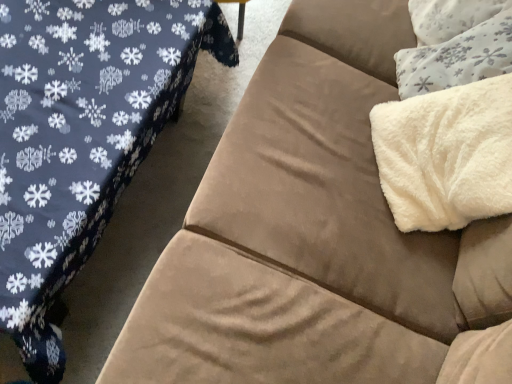
Find the location of a particular element. This screenshot has width=512, height=384. empty space that is ontop of suede couch at right is located at coordinates (81, 91).